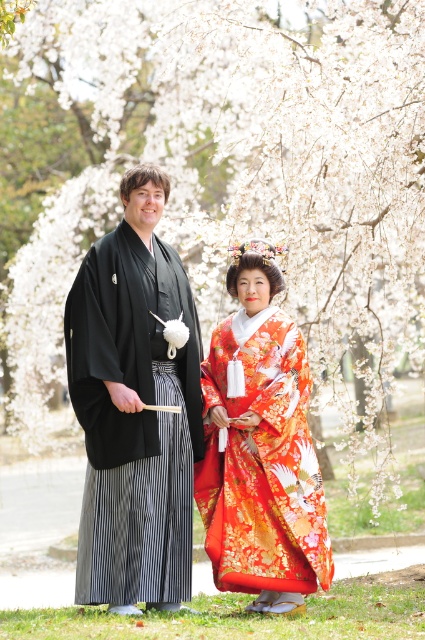
Question: Does black silk kimono at center appear on the right side of silky orange kimono at center?

Choices:
 (A) no
 (B) yes

Answer: (A)

Question: Which point appears closest to the camera in this image?

Choices:
 (A) (138, 220)
 (B) (240, 259)

Answer: (A)

Question: Which of the following is the farthest from the observer?

Choices:
 (A) silky orange kimono at center
 (B) black silk kimono at center

Answer: (A)

Question: Which object appears closest to the camera in this image?

Choices:
 (A) black silk kimono at center
 (B) silky orange kimono at center

Answer: (A)

Question: Is black silk kimono at center wider than silky orange kimono at center?

Choices:
 (A) no
 (B) yes

Answer: (A)

Question: Can you confirm if black silk kimono at center is positioned below silky orange kimono at center?

Choices:
 (A) no
 (B) yes

Answer: (A)